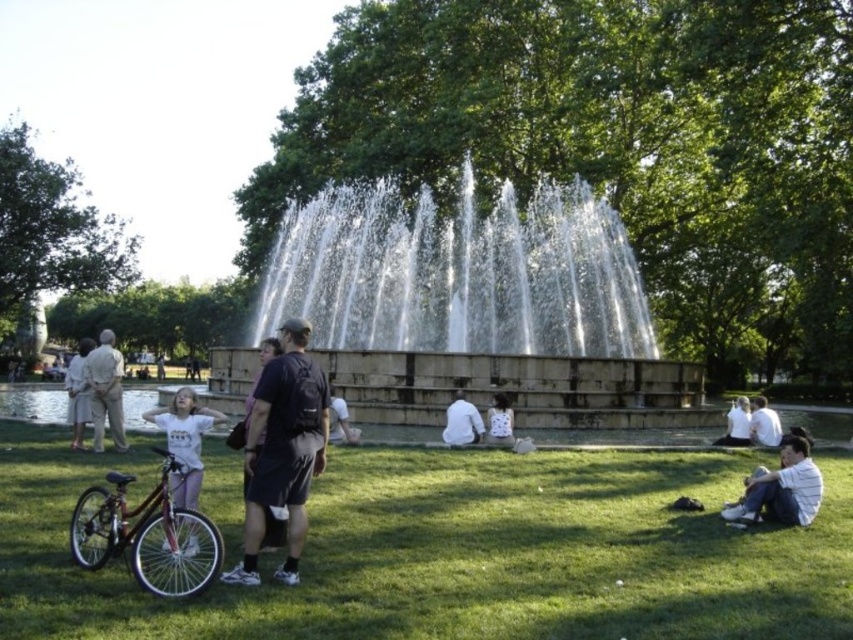
You are standing in the park and want to take a photo of both the man and the girl. The man is at point (12, 476) and the girl is at point (367, 346). Which point should you focus on first to ensure both are in focus?

You should focus on point (12, 476) first because it is closer to the camera than point (367, 346), ensuring both are within the depth of field.

You are standing in the park and see the green grass at lower center and the white cotton shirt at center. Which object is positioned lower in the scene?

The green grass at lower center is positioned below the white cotton shirt at center, so it is lower in the scene.